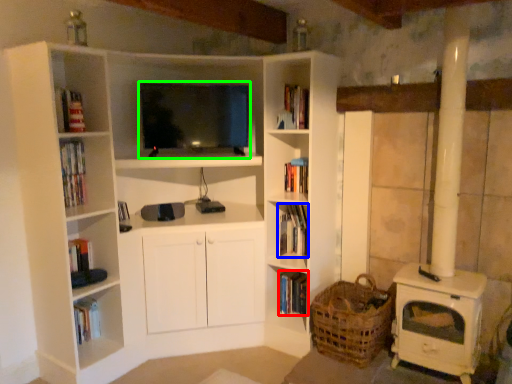
Question: Which is nearer to the book (highlighted by a red box)? book (highlighted by a blue box) or television (highlighted by a green box).

Choices:
 (A) book
 (B) television

Answer: (A)